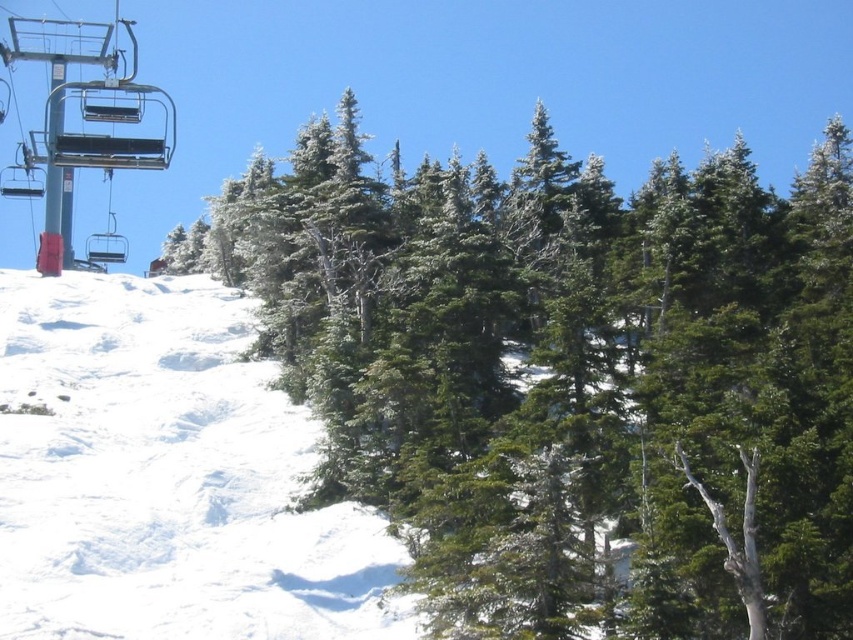
Consider the image. You are a skier planning to descend from the metallic blue ski lift at upper left to the white powdery snow at center. Given that your maximum safe stopping distance is 35 meters, would you be able to safely stop before reaching the snow? Please explain your reasoning.

The distance between the metallic blue ski lift at upper left and the white powdery snow at center is 38.47 meters. Since your maximum safe stopping distance is 35 meters, you would not be able to safely stop before reaching the snow as the distance exceeds the safe limit.

You are standing at the base of the snowy mountain and want to reach the point marked as point (453, 548). Given that your maximum walking distance is 50 meters, can you safely reach it without exceeding your limit?

The point (453, 548) is 61.58 meters away from the viewer, which exceeds your maximum walking distance of 50 meters. Therefore, you cannot safely reach it without exceeding your limit.